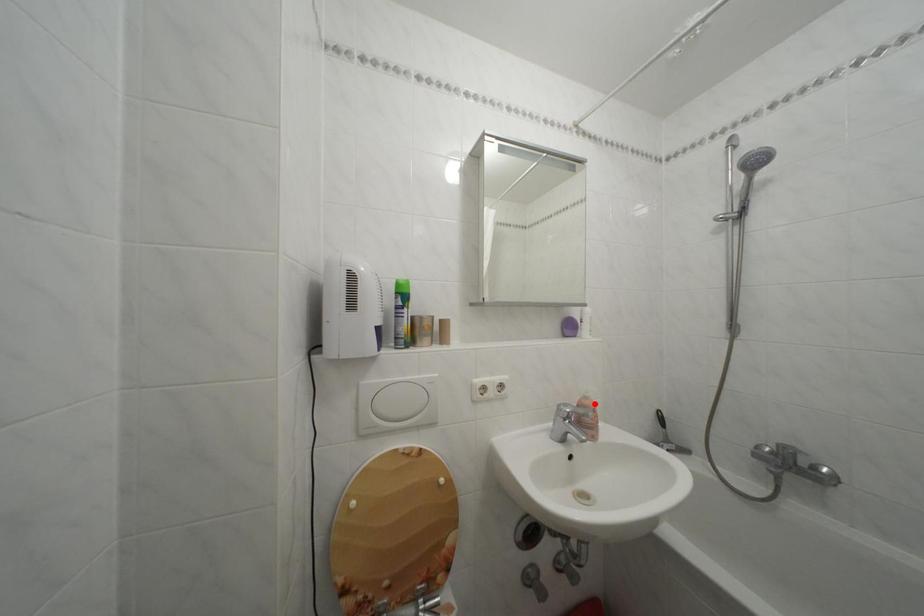
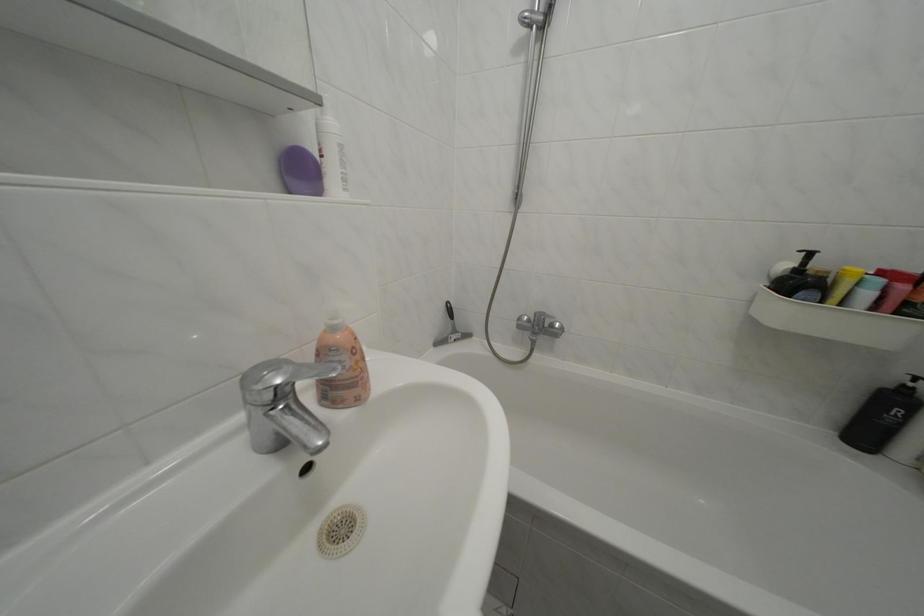
Question: I am providing you with two images of the same scene from different viewpoints. A red point is shown in image1. For the corresponding object point in image2, is it positioned nearer or farther from the camera?

Choices:
 (A) Nearer
 (B) Farther

Answer: (A)